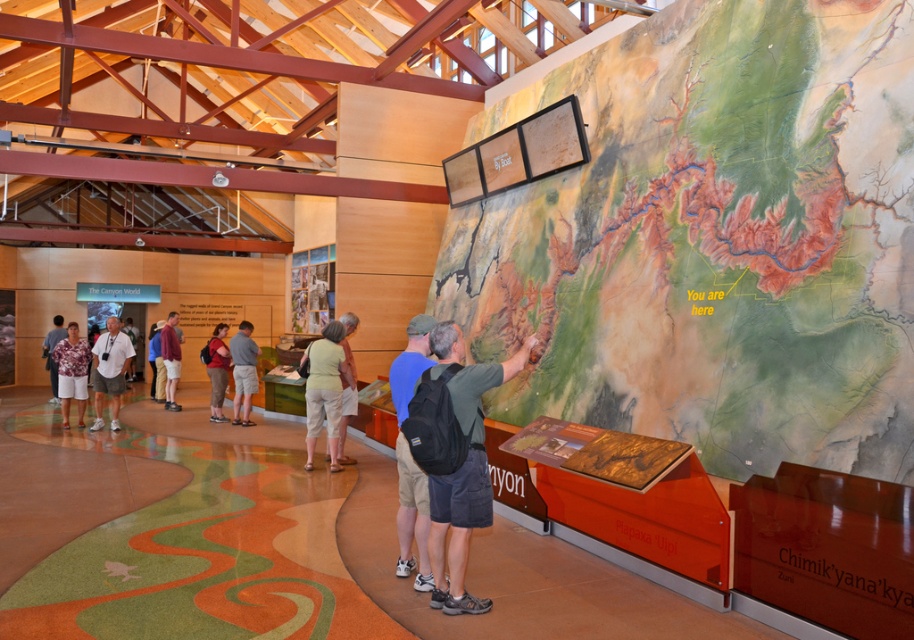
Question: Estimate the real-world distances between objects in this image. Which object is farther from the matte blue shirt at center?

Choices:
 (A) textured paper map at center
 (B) matte black backpack at center
 (C) matte gray shirt at center
 (D) matte brown backpack at center

Answer: (C)

Question: Which of the following is the closest to the observer?

Choices:
 (A) (61, 328)
 (B) (78, 342)
 (C) (459, 349)
 (D) (413, 467)

Answer: (C)

Question: Does light green fabric shorts at center appear under matte brown backpack at center?

Choices:
 (A) no
 (B) yes

Answer: (B)

Question: Is white cotton shirt at left positioned in front of denim shorts at center?

Choices:
 (A) yes
 (B) no

Answer: (A)

Question: Among these points, which one is farthest from the camera?

Choices:
 (A) (120, 333)
 (B) (704, 99)
 (C) (156, 324)
 (D) (469, 534)

Answer: (C)

Question: Where is light green fabric shorts at center located in relation to matte brown backpack at center in the image?

Choices:
 (A) right
 (B) left

Answer: (A)